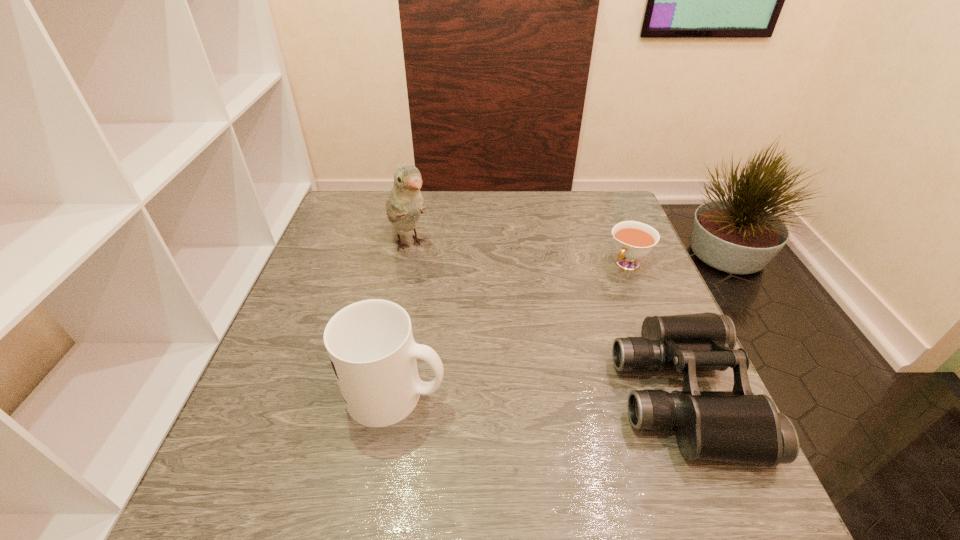
The width and height of the screenshot is (960, 540). In order to click on the third shortest object in this screenshot , I will do `click(370, 343)`.

What are the coordinates of `binoculars` in the screenshot? It's located at (736, 426).

The image size is (960, 540). Find the location of `teacup`. teacup is located at coordinates (633, 240).

You are a GUI agent. You are given a task and a screenshot of the screen. Output one action in this format:
    pyautogui.click(x=<x>, y=<y>)
    Task: Click on the bird
    
    Given the screenshot: What is the action you would take?
    pyautogui.click(x=405, y=204)

Identify the location of vacant space located on the handle side of the third shortest object. The height and width of the screenshot is (540, 960). (609, 394).

You are a GUI agent. You are given a task and a screenshot of the screen. Output one action in this format:
    pyautogui.click(x=<x>, y=<y>)
    Task: Click on the vacant region located on the side of the teacup with the handle
    This screenshot has width=960, height=540.
    Given the screenshot: What is the action you would take?
    pyautogui.click(x=562, y=335)

The height and width of the screenshot is (540, 960). What are the coordinates of `free location located on the side of the teacup with the handle` in the screenshot? It's located at (573, 323).

Image resolution: width=960 pixels, height=540 pixels. I want to click on vacant space situated 0.110m on the side of the teacup with the handle, so click(x=596, y=298).

You are a GUI agent. You are given a task and a screenshot of the screen. Output one action in this format:
    pyautogui.click(x=<x>, y=<y>)
    Task: Click on the vacant space located 0.140m at the face of the tallest object
    The width and height of the screenshot is (960, 540).
    Given the screenshot: What is the action you would take?
    pyautogui.click(x=442, y=295)

At what (x,y) coordinates should I click in order to perform the action: click on vacant space located at the face of the tallest object. Please return your answer as a coordinate pair (x, y). This screenshot has height=540, width=960. Looking at the image, I should click on (450, 307).